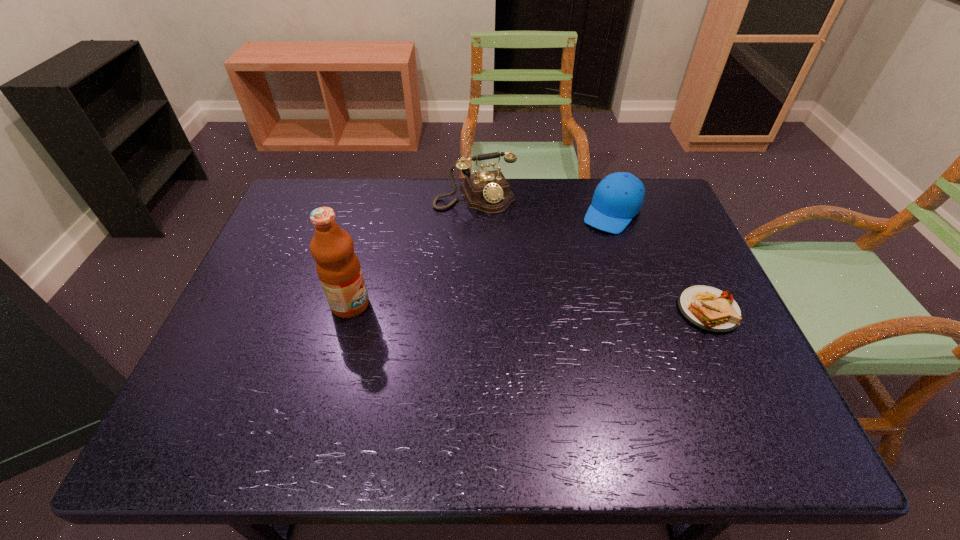
The width and height of the screenshot is (960, 540). In order to click on unoccupied position between the shortest object and the cap in this screenshot , I will do `click(660, 261)`.

Identify the location of free space between the third object from right to left and the cap. (543, 204).

This screenshot has height=540, width=960. I want to click on free space between the shortest object and the leftmost object, so click(529, 307).

Locate an element on the screen. empty location between the third object from right to left and the shortest object is located at coordinates (591, 253).

At what (x,y) coordinates should I click in order to perform the action: click on free space between the second tallest object and the cap. Please return your answer as a coordinate pair (x, y). The image size is (960, 540). Looking at the image, I should click on (543, 204).

This screenshot has height=540, width=960. I want to click on object that stands as the second closest to the third tallest object, so click(x=708, y=308).

Identify the location of object that is the second closest to the second object from left to right. The image size is (960, 540). (338, 267).

The height and width of the screenshot is (540, 960). I want to click on vacant region that satisfies the following two spatial constraints: 1. on the front side of the telephone; 2. on the right side of the cap, so click(474, 212).